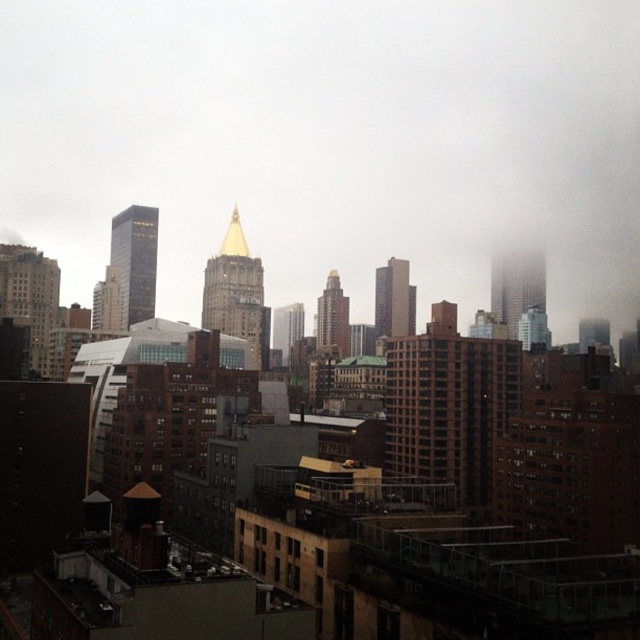
Does transparent fog at center have a larger size compared to gold polished spire at center?

Indeed, transparent fog at center has a larger size compared to gold polished spire at center.

Is transparent fog at center in front of gold polished spire at center?

No, it is behind gold polished spire at center.

What do you see at coordinates (332, 141) in the screenshot?
I see `transparent fog at center` at bounding box center [332, 141].

The height and width of the screenshot is (640, 640). I want to click on transparent fog at center, so click(x=332, y=141).

Is the position of smooth gray skyscraper at center more distant than that of matte glass skyscraper at left?

Yes, it is.

Is smooth gray skyscraper at center to the left of matte glass skyscraper at left from the viewer's perspective?

In fact, smooth gray skyscraper at center is to the right of matte glass skyscraper at left.

What are the coordinates of `smooth gray skyscraper at center` in the screenshot? It's located at (394, 300).

Is brick building at left in front of smokey glass skyscraper at upper right?

Yes, it is.

Is brick building at left wider than smokey glass skyscraper at upper right?

No, brick building at left is not wider than smokey glass skyscraper at upper right.

Does point (29, 248) come farther from viewer compared to point (538, 294)?

No.

Where is `brick building at left`? The height and width of the screenshot is (640, 640). brick building at left is located at coordinates (29, 298).